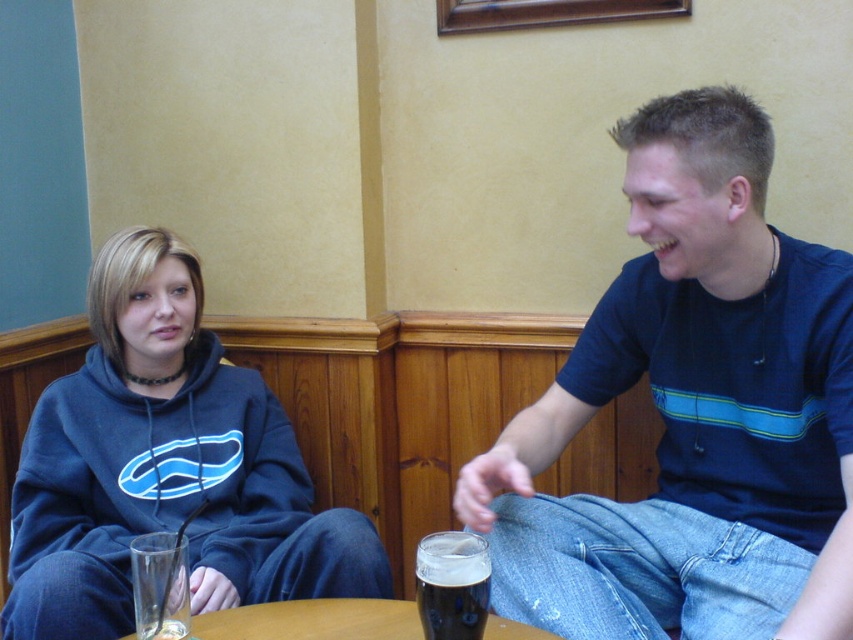
Question: Which point appears closest to the camera in this image?

Choices:
 (A) (706, 230)
 (B) (448, 547)

Answer: (B)

Question: Does wooden table at center appear over clear glass at lower left?

Choices:
 (A) no
 (B) yes

Answer: (A)

Question: Which of the following is the farthest from the observer?

Choices:
 (A) (154, 632)
 (B) (271, 636)
 (C) (192, 291)

Answer: (C)

Question: Among these points, which one is farthest from the camera?

Choices:
 (A) (142, 548)
 (B) (527, 636)
 (C) (427, 620)

Answer: (B)

Question: Is blue cotton t-shirt at right thinner than matte blue hoodie at left?

Choices:
 (A) no
 (B) yes

Answer: (B)

Question: Can you confirm if matte blue hoodie at left is bigger than dark matte beer at lower center?

Choices:
 (A) yes
 (B) no

Answer: (A)